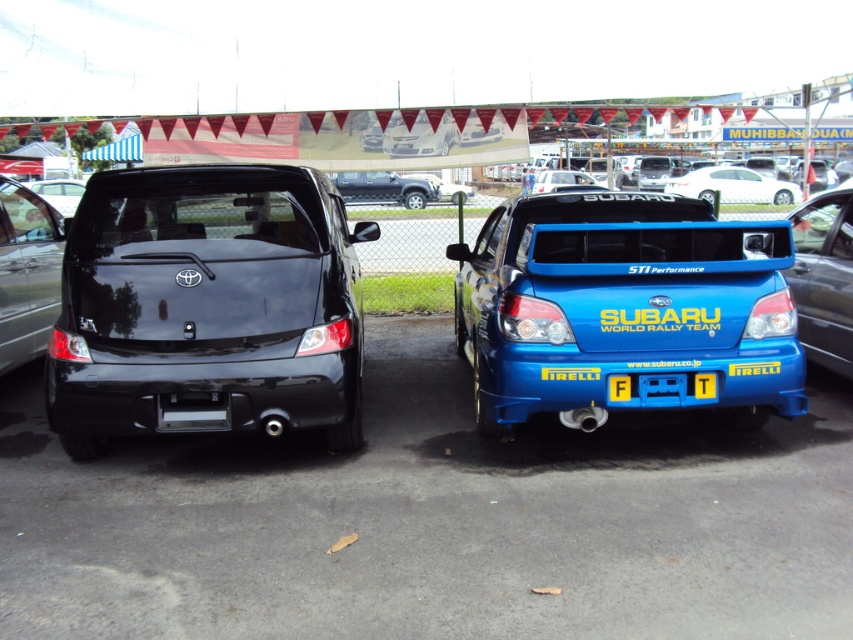
You are standing at the camera position and want to take a photo of the blue metallic sedan at right. The parking lot has a rule that you must stay at least 20 feet away from any vehicle. Are you compliant with this rule?

The blue metallic sedan at right and camera are 19.52 feet apart, so you are not compliant with the parking lot rule since you are 0.48 feet too close.

You are a parking attendant checking the distance between the blue metallic sedan at right and the yellow plastic license plate at center. Which object is closer to you?

The blue metallic sedan at right is closer to you than the yellow plastic license plate at center.

You are a parking attendant and need to fit both the glossy black sedan at left and the white glossy sedan at upper center into a narrow parking space. Which car should you move first to ensure they both fit?

The glossy black sedan at left is thinner than the white glossy sedan at upper center, so you should move the white glossy sedan at upper center first to accommodate its wider size in the narrow space.